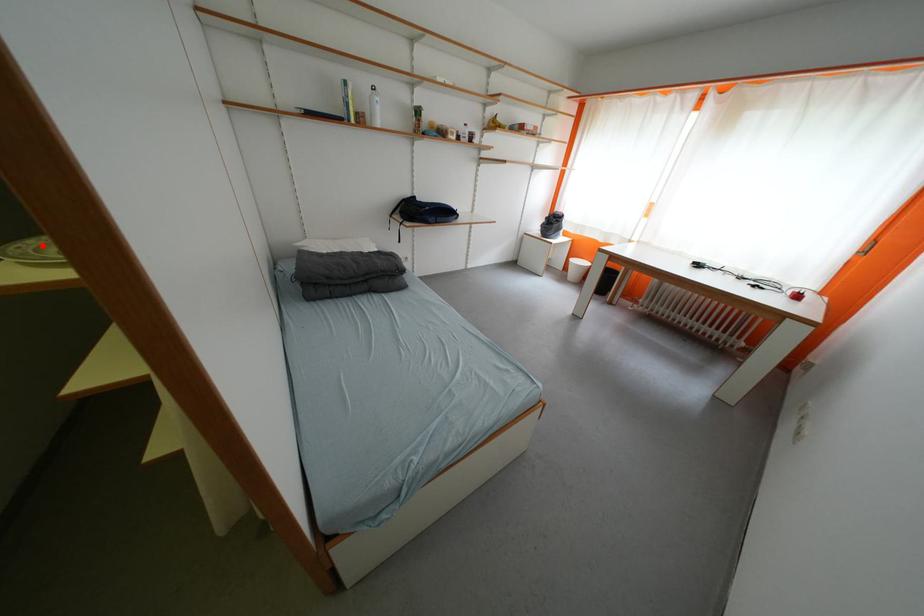
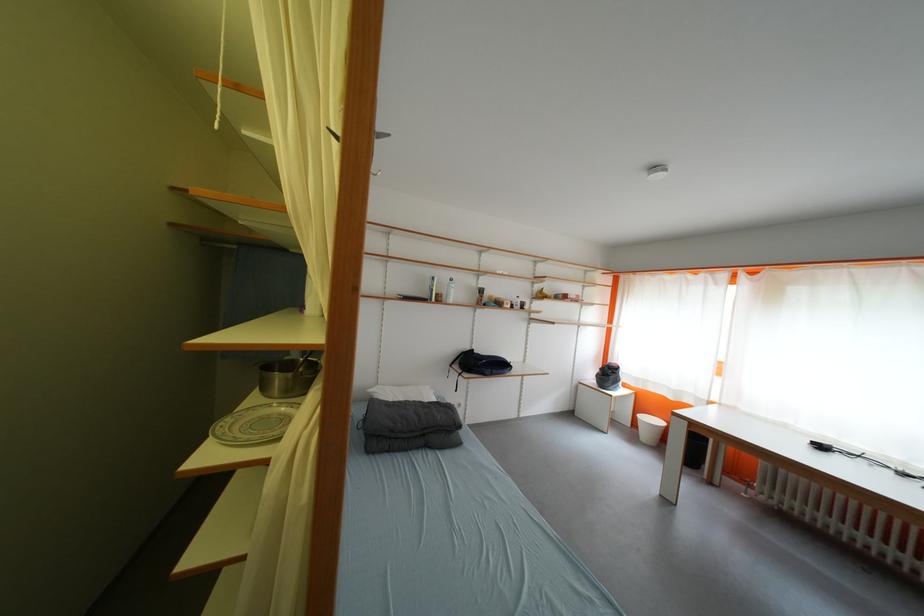
In the second image, find the point that corresponds to the highlighted location in the first image.

(237, 422)